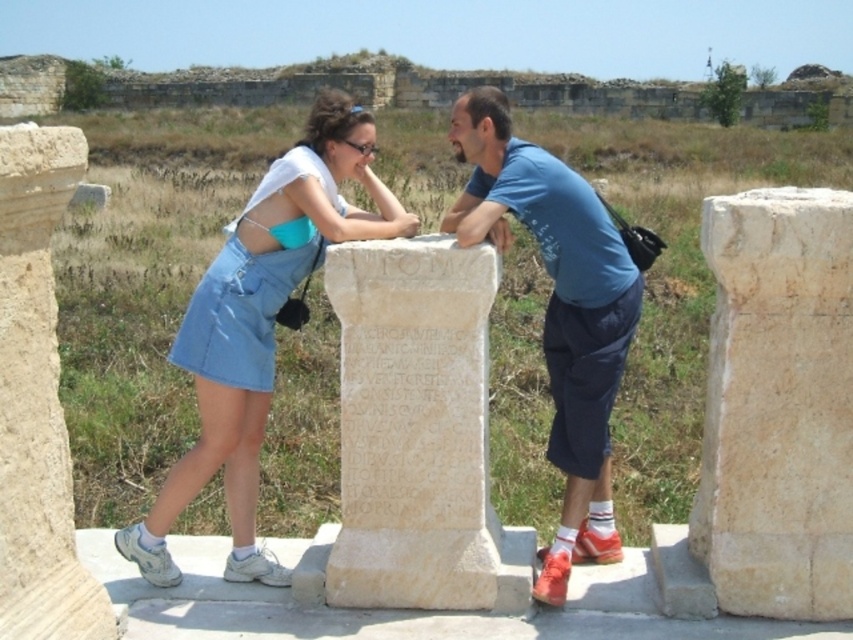
Does beige stone pillar at right appear under beige stone pillar at left?

Indeed, beige stone pillar at right is positioned under beige stone pillar at left.

Is point (752, 259) closer to viewer compared to point (16, 611)?

No, (752, 259) is behind (16, 611).

This screenshot has height=640, width=853. In order to click on beige stone pillar at right in this screenshot , I will do `click(778, 404)`.

Is point (248, 500) farther from camera compared to point (579, 413)?

Yes.

Find the location of a particular element. This screenshot has width=853, height=640. denim skirt at center is located at coordinates (259, 326).

Can you confirm if white marble stone at center is positioned to the left of beige stone pillar at left?

In fact, white marble stone at center is to the right of beige stone pillar at left.

Locate an element on the screen. The height and width of the screenshot is (640, 853). white marble stone at center is located at coordinates (415, 428).

Does point (341, 488) come farther from viewer compared to point (57, 163)?

Yes, point (341, 488) is farther from viewer.

The image size is (853, 640). In order to click on white marble stone at center in this screenshot , I will do `click(415, 428)`.